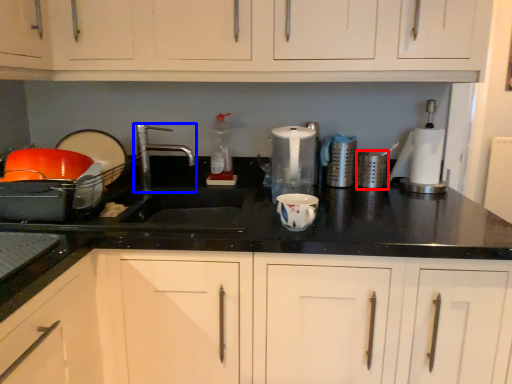
Question: Which object is further to the camera taking this photo, appliance (highlighted by a red box) or tap (highlighted by a blue box)?

Choices:
 (A) appliance
 (B) tap

Answer: (A)